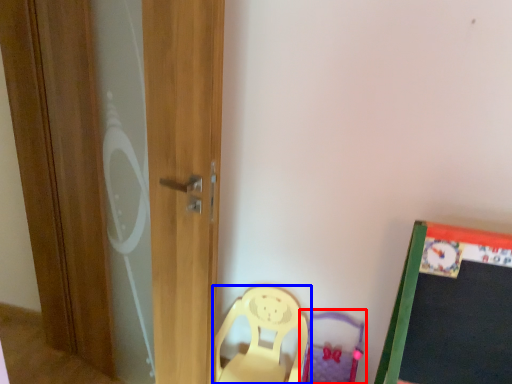
Question: Which object is further to the camera taking this photo, swivel chair (highlighted by a red box) or chair (highlighted by a blue box)?

Choices:
 (A) swivel chair
 (B) chair

Answer: (B)